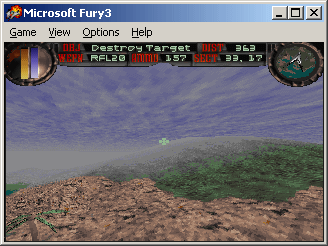
Locate an element on the screen. The height and width of the screenshot is (246, 328). clock is located at coordinates (306, 64).